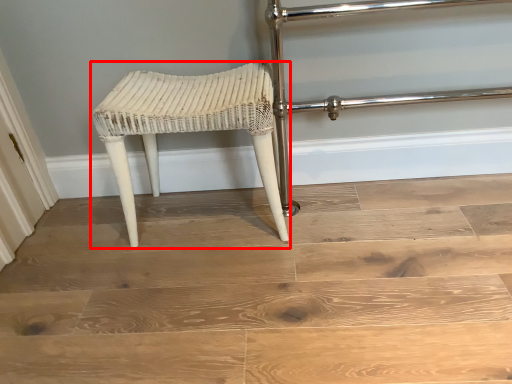
Question: From the image's perspective, what is the correct spatial relationship of stool (annotated by the red box) in relation to stairwell?

Choices:
 (A) below
 (B) above

Answer: (B)